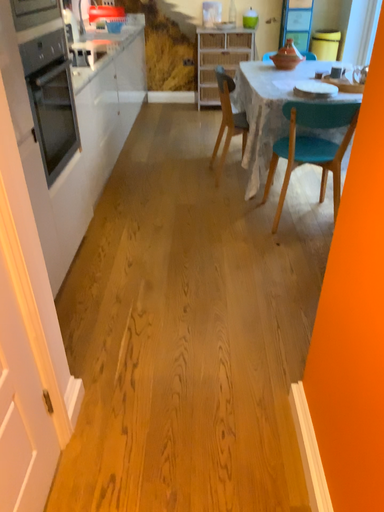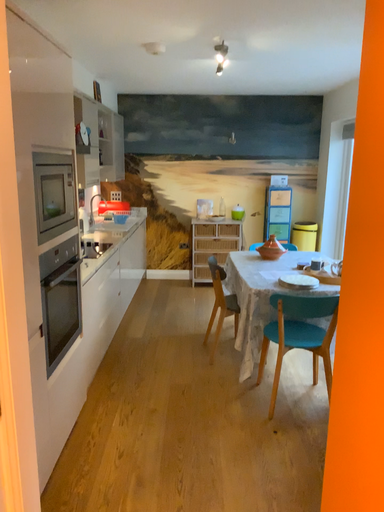
Question: How did the camera likely rotate when shooting the video?

Choices:
 (A) rotated downward
 (B) rotated upward

Answer: (B)